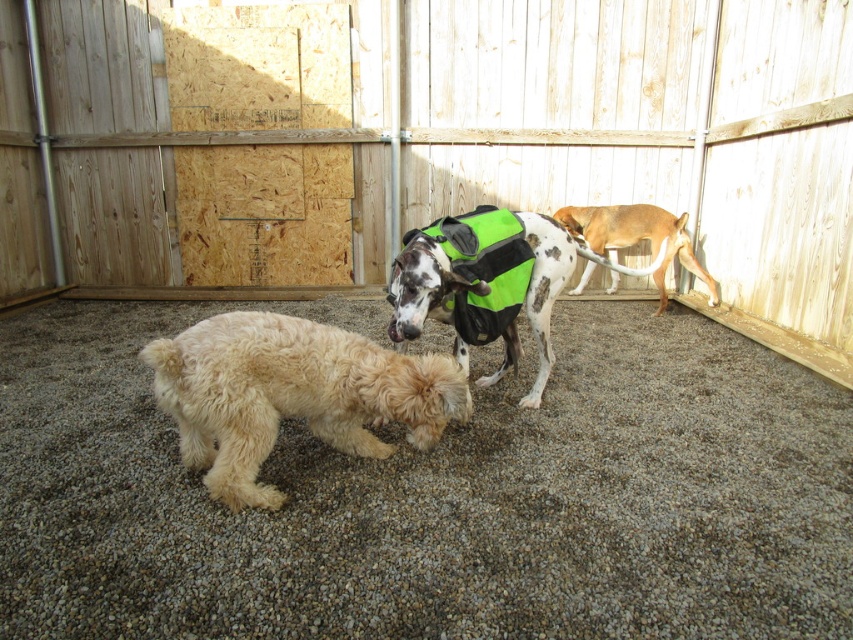
Does wooden fence at center appear under fuzzy beige dog at lower left?

No, wooden fence at center is not below fuzzy beige dog at lower left.

Does wooden fence at center have a smaller size compared to fuzzy beige dog at lower left?

No, wooden fence at center is not smaller than fuzzy beige dog at lower left.

This screenshot has width=853, height=640. Describe the element at coordinates (648, 129) in the screenshot. I see `wooden fence at center` at that location.

Locate an element on the screen. This screenshot has width=853, height=640. wooden fence at center is located at coordinates (648, 129).

Is point (625, 48) closer to viewer compared to point (502, 330)?

No.

Which of these two, wooden fence at center or green fabric dog at center, stands taller?

wooden fence at center

Is point (125, 152) positioned behind point (518, 291)?

Yes.

What are the coordinates of `wooden fence at center` in the screenshot? It's located at (648, 129).

Does point (231, 369) come behind point (601, 209)?

No, it is not.

What do you see at coordinates (291, 394) in the screenshot? The image size is (853, 640). I see `fuzzy beige dog at lower left` at bounding box center [291, 394].

What do you see at coordinates (291, 394) in the screenshot?
I see `fuzzy beige dog at lower left` at bounding box center [291, 394].

The width and height of the screenshot is (853, 640). I want to click on fuzzy beige dog at lower left, so click(291, 394).